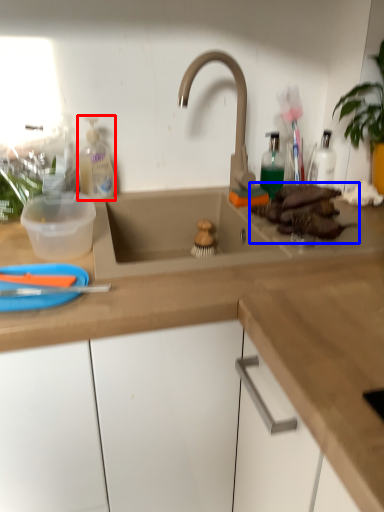
Question: Which object is closer to the camera taking this photo, cleaning product (highlighted by a red box) or food (highlighted by a blue box)?

Choices:
 (A) cleaning product
 (B) food

Answer: (B)